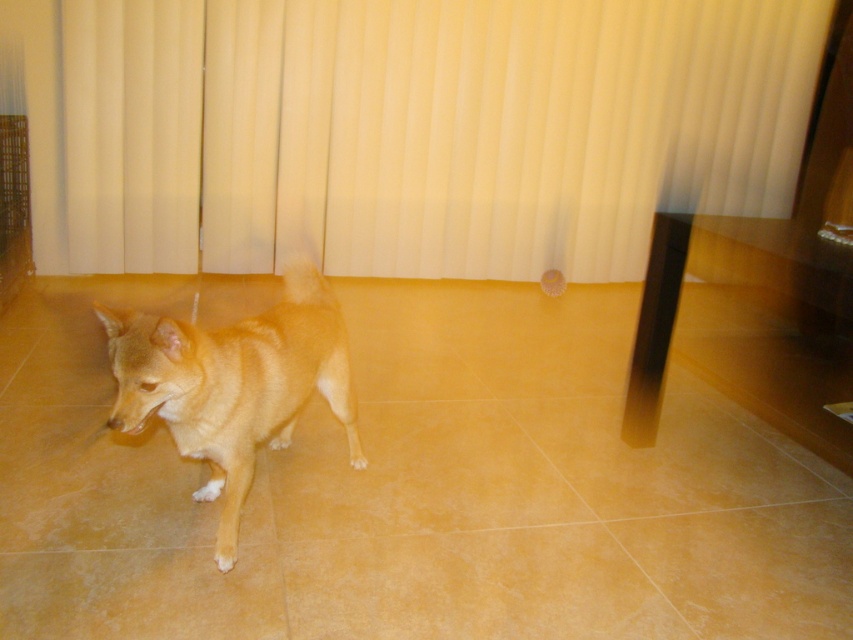
Question: Is beige fabric curtain at upper center wider than golden fur dog at center?

Choices:
 (A) no
 (B) yes

Answer: (B)

Question: Where is beige fabric curtain at upper center located in relation to golden fur dog at center in the image?

Choices:
 (A) below
 (B) above

Answer: (B)

Question: Which of the following is the closest to the observer?

Choices:
 (A) (610, 212)
 (B) (242, 342)

Answer: (B)

Question: From the image, what is the correct spatial relationship of beige fabric curtain at upper center in relation to golden fur dog at center?

Choices:
 (A) left
 (B) right

Answer: (B)